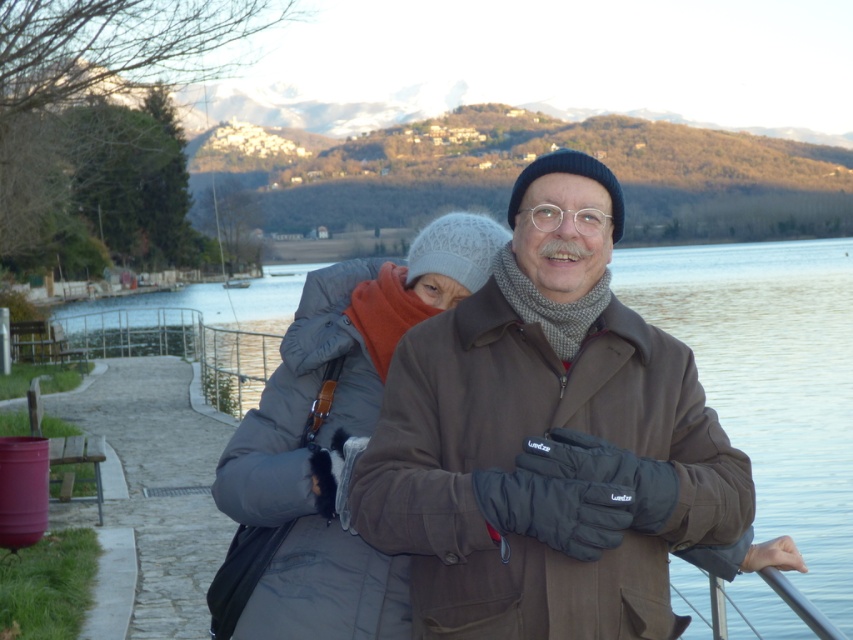
Looking at this image, is gray down jacket at center in front of white plastic boat at center?

Yes, it is.

Which is above, gray down jacket at center or white plastic boat at center?

white plastic boat at center is above.

Does point (231, 545) lie in front of point (228, 282)?

Yes, it is.

Identify the location of gray down jacket at center. (328, 442).

Between point (593, 614) and point (320, 600), which one is positioned behind?

Point (320, 600)

Between brown quilted jacket at center and gray down jacket at center, which one has less height?

gray down jacket at center is shorter.

Identify the location of brown quilted jacket at center. The height and width of the screenshot is (640, 853). (548, 440).

Can you confirm if brown quilted jacket at center is positioned to the right of clear water at center?

No, brown quilted jacket at center is not to the right of clear water at center.

In the scene shown: Does brown quilted jacket at center have a greater height compared to clear water at center?

No.

Between point (537, 189) and point (761, 442), which one is positioned in front?

Point (537, 189) is more forward.

I want to click on brown quilted jacket at center, so click(x=548, y=440).